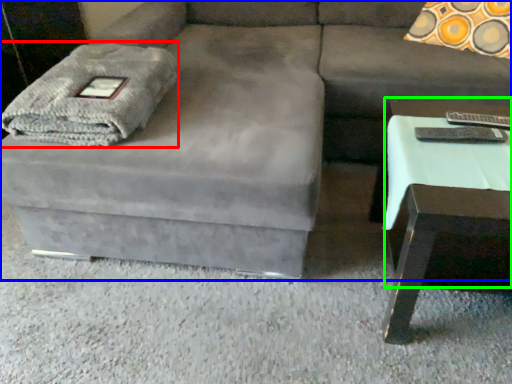
Question: Considering the real-world distances, which object is closest to blanket (highlighted by a red box)? studio couch (highlighted by a blue box) or side table (highlighted by a green box).

Choices:
 (A) studio couch
 (B) side table

Answer: (A)